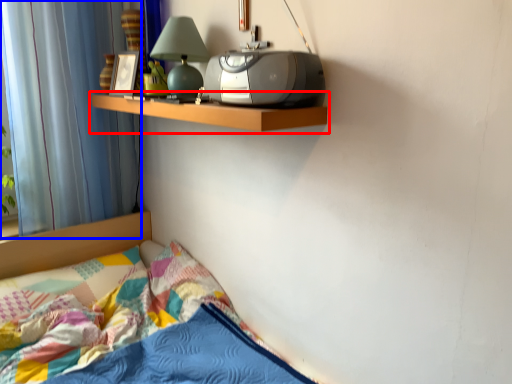
Question: Which object is closer to the camera taking this photo, shelf (highlighted by a red box) or curtain (highlighted by a blue box)?

Choices:
 (A) shelf
 (B) curtain

Answer: (A)